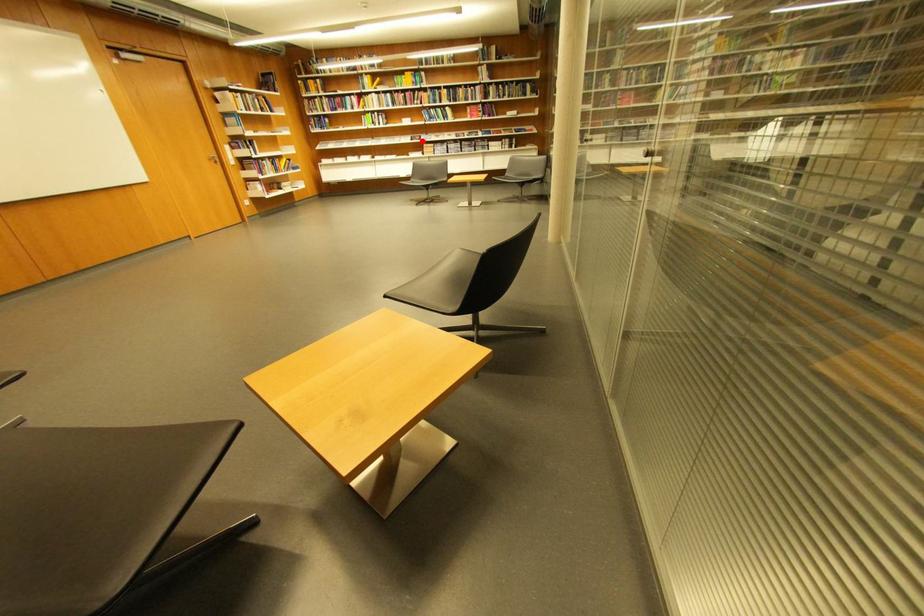
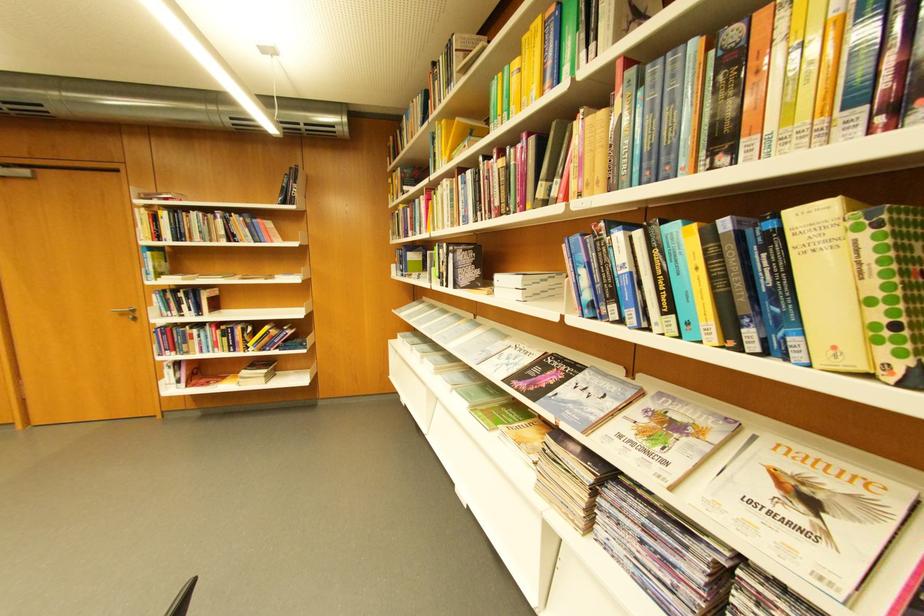
Question: I am providing you with two images of the same scene from different viewpoints. Given a red point in image1, look at the same physical point in image2. Is it:

Choices:
 (A) Closer to the viewpoint
 (B) Farther from the viewpoint

Answer: (B)